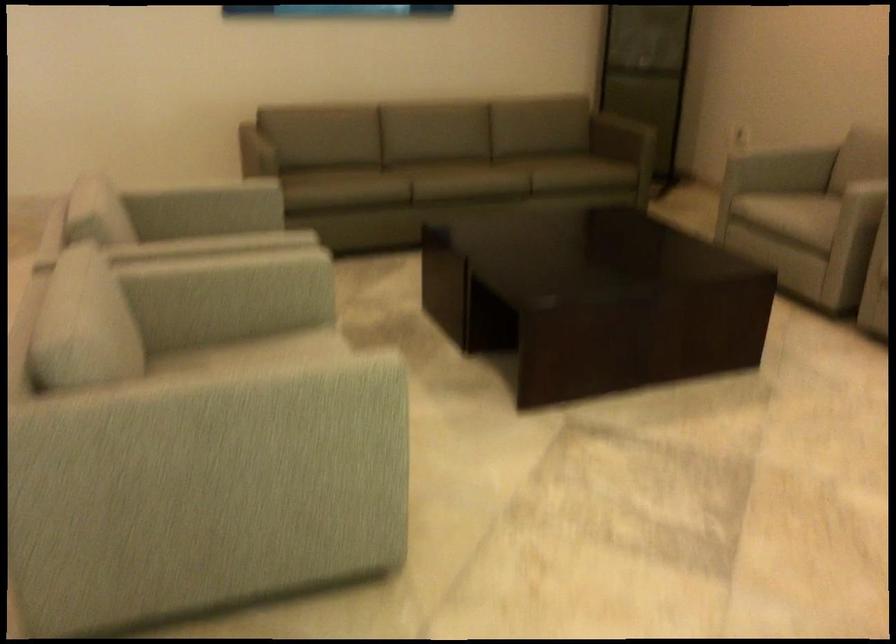
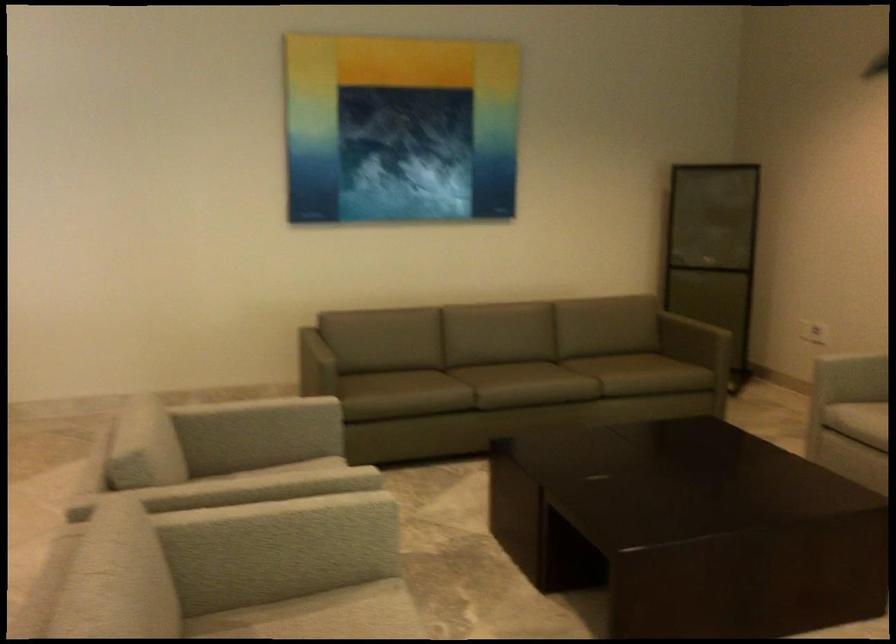
The point at (231, 275) is marked in the first image. Where is the corresponding point in the second image?

(289, 529)